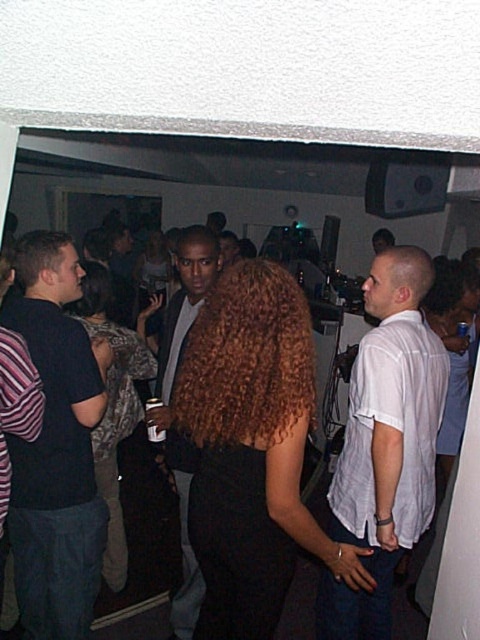
From the picture: What are the coordinates of the leather jacket at center?

The leather jacket at center is located at coordinates 0.484 and 0.381.

You are at a party and want to grab the leather jacket at center without touching the curly hair at center. Is the space between them enough to reach the jacket?

The leather jacket at center is bigger than curly hair at center, so there is sufficient space to reach the jacket without touching the curly hair at center.